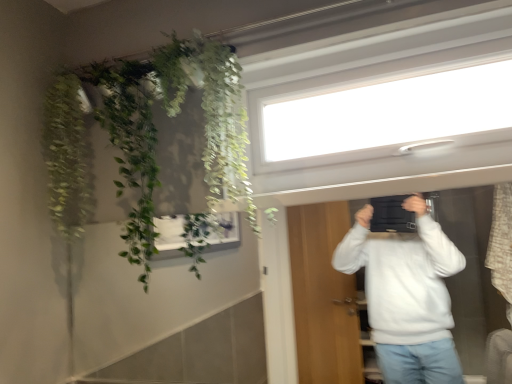
Question: Is green leafy plant at upper left, which appears as the first plant when viewed from the left, bigger than green leafy plant at upper left, the first plant viewed from the right?

Choices:
 (A) no
 (B) yes

Answer: (A)

Question: Is green leafy plant at upper left, acting as the second plant starting from the right, shorter than green leafy plant at upper left, the first plant viewed from the right?

Choices:
 (A) yes
 (B) no

Answer: (A)

Question: Is the position of green leafy plant at upper left, acting as the second plant starting from the right, less distant than that of green leafy plant at upper left, the first plant viewed from the right?

Choices:
 (A) yes
 (B) no

Answer: (B)

Question: Does green leafy plant at upper left, which appears as the first plant when viewed from the left, have a lesser width compared to green leafy plant at upper left, the first plant viewed from the right?

Choices:
 (A) yes
 (B) no

Answer: (A)

Question: From the image's perspective, is green leafy plant at upper left, acting as the second plant starting from the right, on green leafy plant at upper left, the first plant viewed from the right?

Choices:
 (A) yes
 (B) no

Answer: (A)

Question: From a real-world perspective, is green leafy plant at upper left, acting as the second plant starting from the right, under green leafy plant at upper left, the first plant viewed from the right?

Choices:
 (A) yes
 (B) no

Answer: (B)

Question: Considering the relative positions of transparent glass window at upper center and green leafy plant at upper left, which appears as the first plant when viewed from the left, in the image provided, is transparent glass window at upper center to the left of green leafy plant at upper left, which appears as the first plant when viewed from the left, from the viewer's perspective?

Choices:
 (A) no
 (B) yes

Answer: (A)

Question: Is transparent glass window at upper center facing towards green leafy plant at upper left, which appears as the first plant when viewed from the left?

Choices:
 (A) yes
 (B) no

Answer: (B)

Question: Would you say transparent glass window at upper center contains green leafy plant at upper left, acting as the second plant starting from the right?

Choices:
 (A) no
 (B) yes

Answer: (A)

Question: From the image's perspective, is transparent glass window at upper center located above green leafy plant at upper left, acting as the second plant starting from the right?

Choices:
 (A) no
 (B) yes

Answer: (B)

Question: Is transparent glass window at upper center not within green leafy plant at upper left, which appears as the first plant when viewed from the left?

Choices:
 (A) yes
 (B) no

Answer: (A)

Question: Can you confirm if transparent glass window at upper center is thinner than green leafy plant at upper left, which appears as the first plant when viewed from the left?

Choices:
 (A) yes
 (B) no

Answer: (A)

Question: Is transparent glass window at upper center located outside green leafy plant at upper left, the first plant viewed from the right?

Choices:
 (A) no
 (B) yes

Answer: (B)